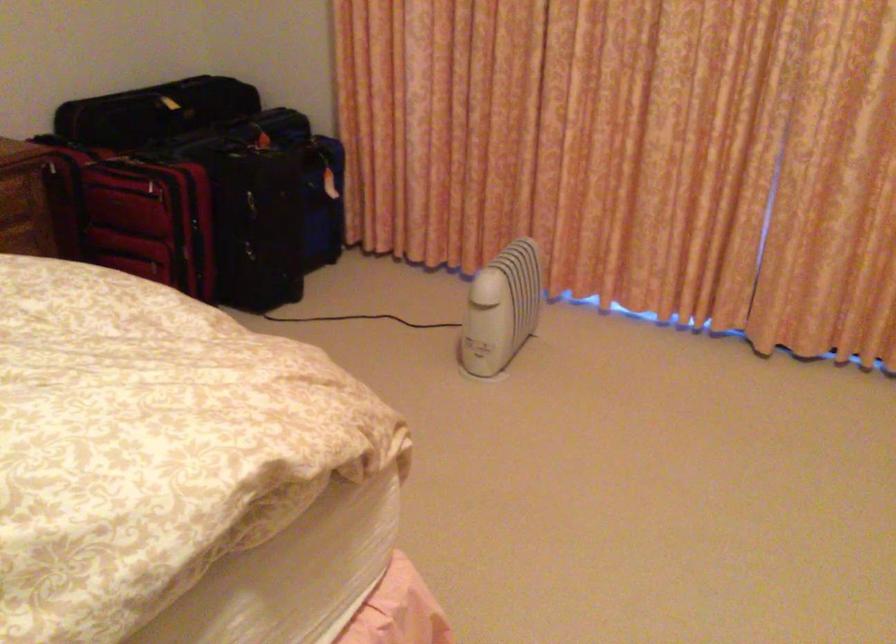
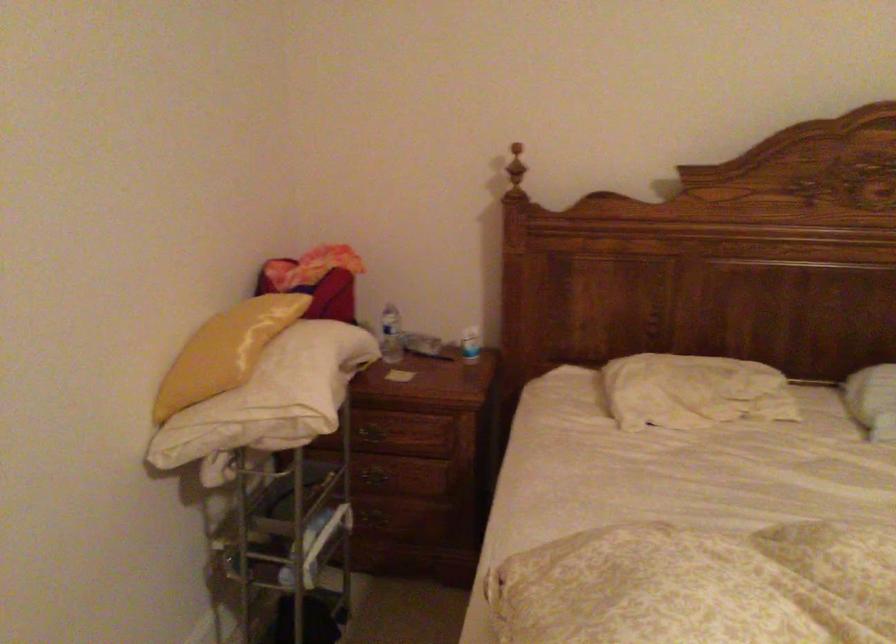
Question: Based on the continuous images, in which direction is the camera rotating? Reply with the corresponding letter.

Choices:
 (A) Left
 (B) Right
 (C) Up
 (D) Down

Answer: (A)